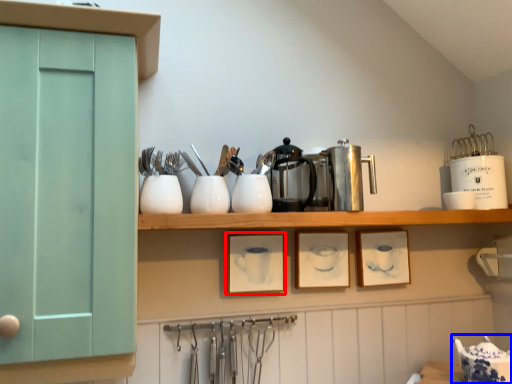
Question: Among these objects, which one is farthest to the camera, picture frame (highlighted by a red box) or tableware (highlighted by a blue box)?

Choices:
 (A) picture frame
 (B) tableware

Answer: (A)